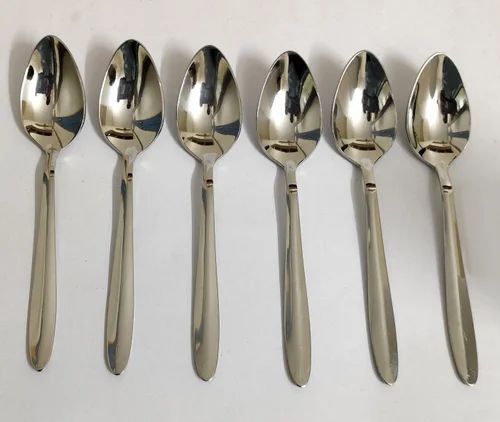
Identify the location of spoons. This screenshot has height=422, width=500. (37, 101), (133, 89), (217, 122), (295, 131), (372, 108), (443, 122).